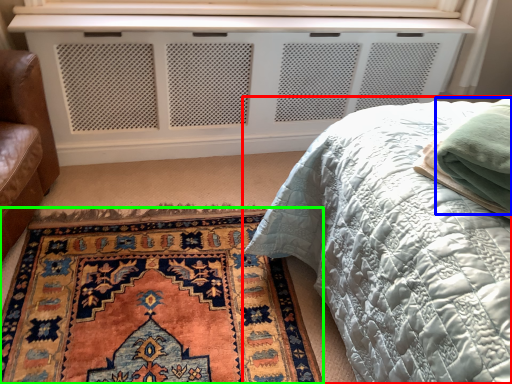
Question: Which object is the farthest from bed (highlighted by a red box)? Choose among these: material (highlighted by a blue box) or mat (highlighted by a green box).

Choices:
 (A) material
 (B) mat

Answer: (B)